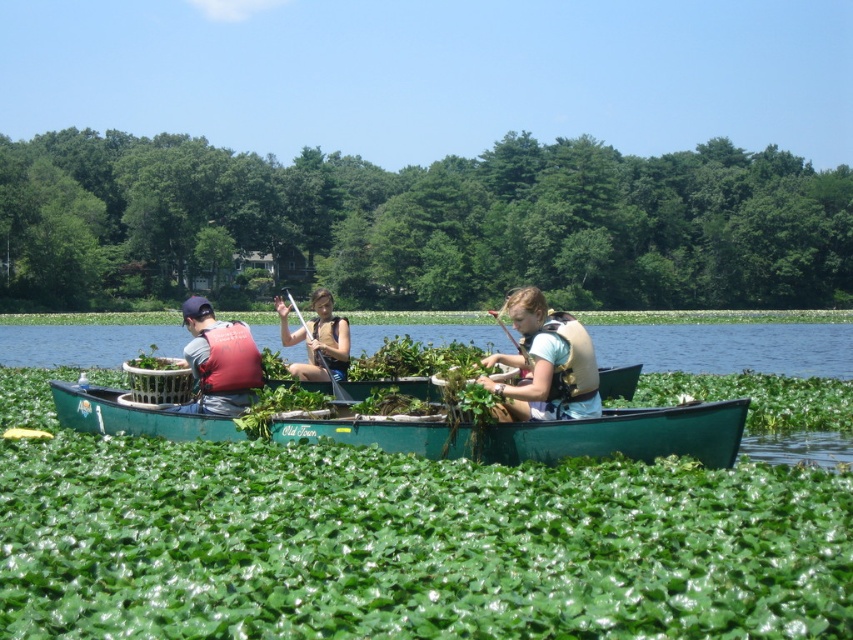
You are a safety inspector checking the canoe setup in the image. The green plastic canoe at center and the matte brown life vest at center must be positioned correctly for safety. According to the scene, which object is positioned to the right of the other?

The green plastic canoe at center is to the right of matte brown life vest at center.